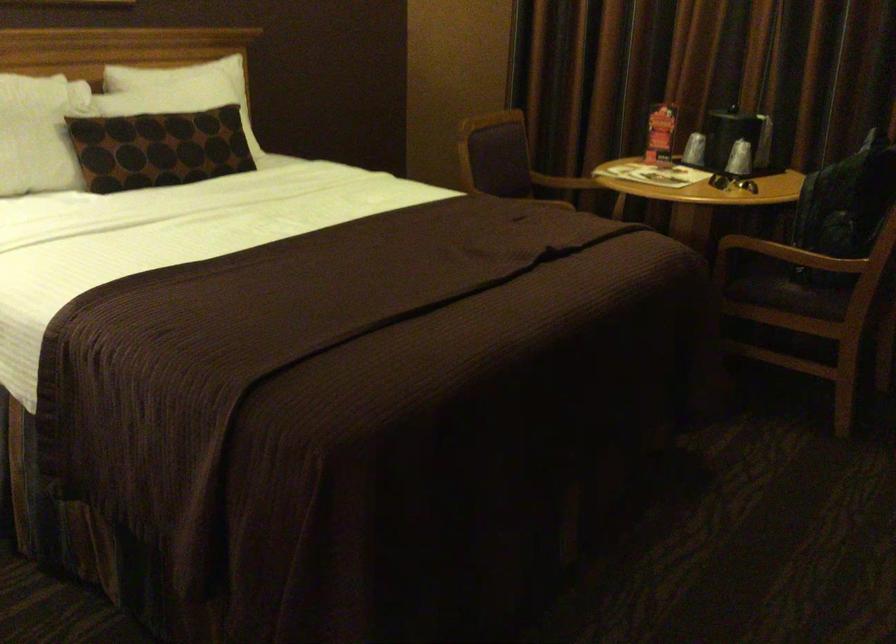
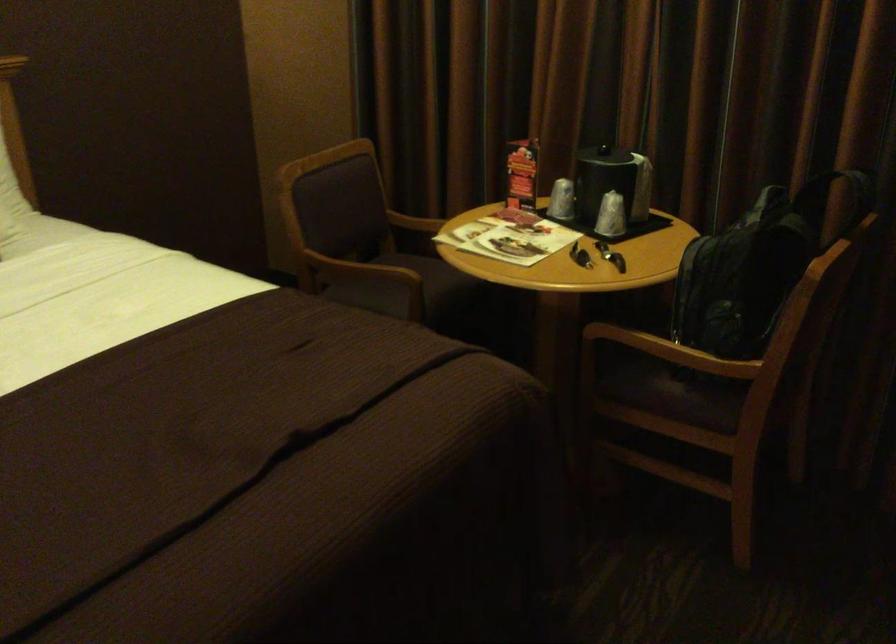
Question: I am providing you with two images of the same scene from different viewpoints. Which of the following objects are not visible in image2?

Choices:
 (A) black backpack
 (B) set of keys
 (C) ice bucket lid knob
 (D) none of these

Answer: (D)